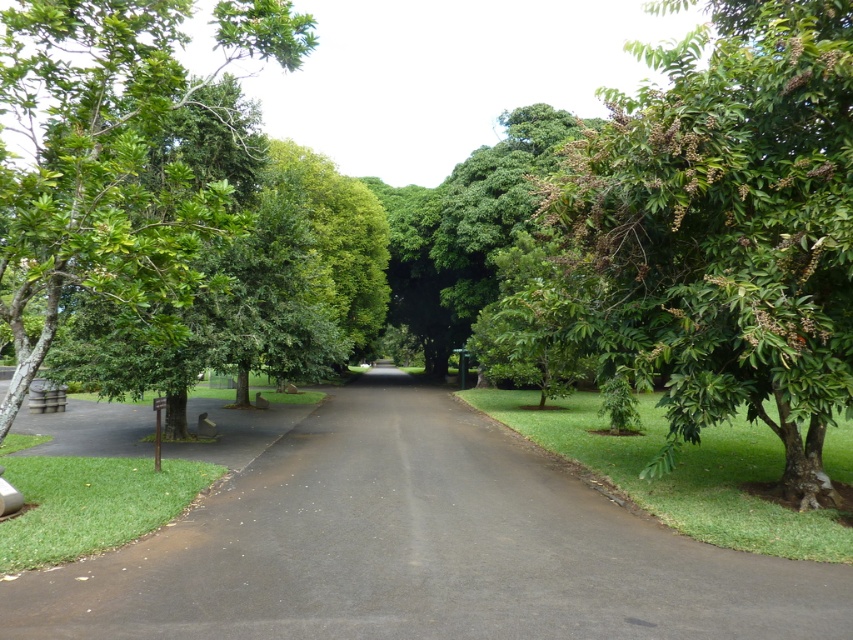
Is black asphalt road at center to the left of green leafy tree at right from the viewer's perspective?

Yes, black asphalt road at center is to the left of green leafy tree at right.

Based on the photo, which is more to the left, black asphalt road at center or green leafy tree at right?

Positioned to the left is black asphalt road at center.

Describe the element at coordinates (419, 547) in the screenshot. I see `black asphalt road at center` at that location.

Where is `black asphalt road at center`? black asphalt road at center is located at coordinates pyautogui.click(x=419, y=547).